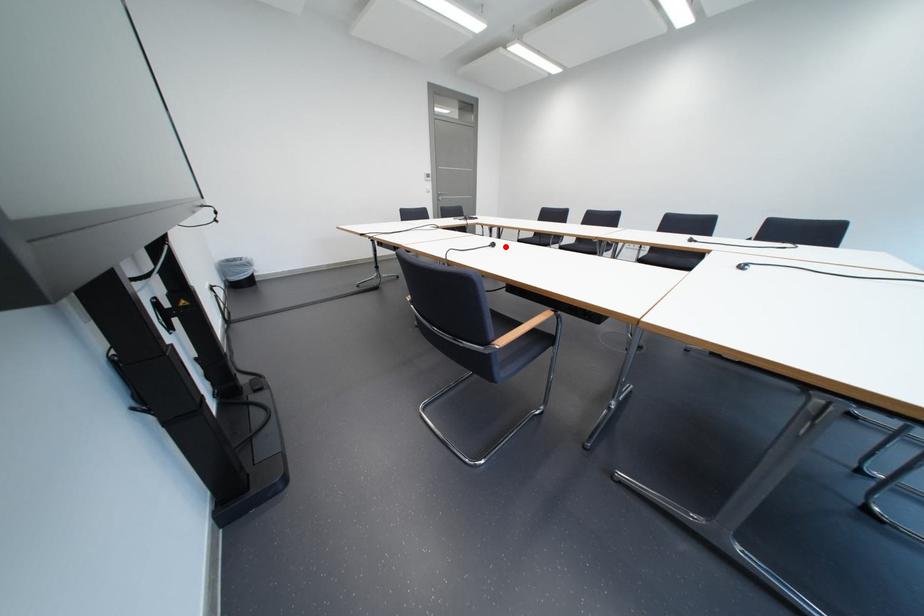
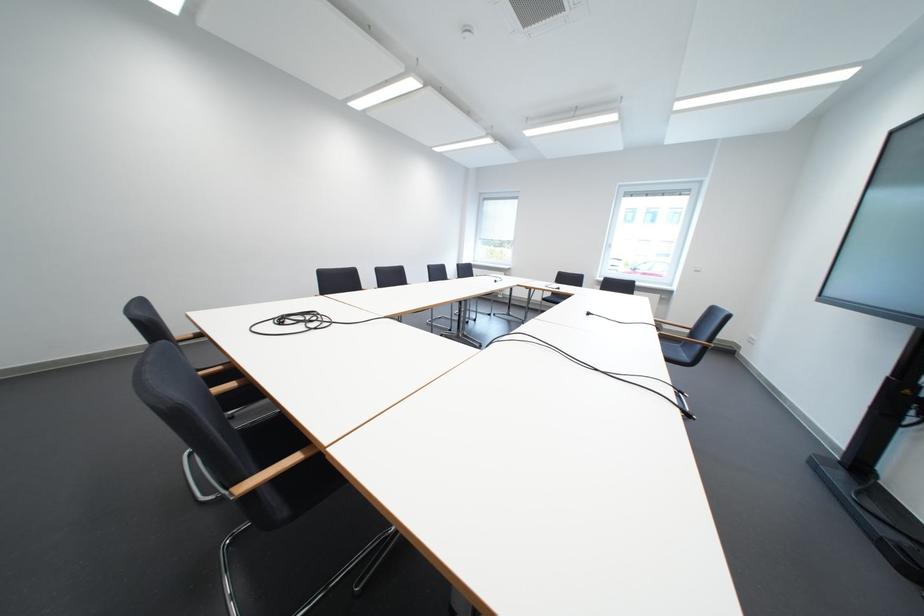
Question: I am providing you with two images of the same scene from different viewpoints. Image1 has a red point marked. In image2, the corresponding 3D location appears at what relative position? Reply with the corresponding letter.

Choices:
 (A) Closer
 (B) Farther

Answer: (A)